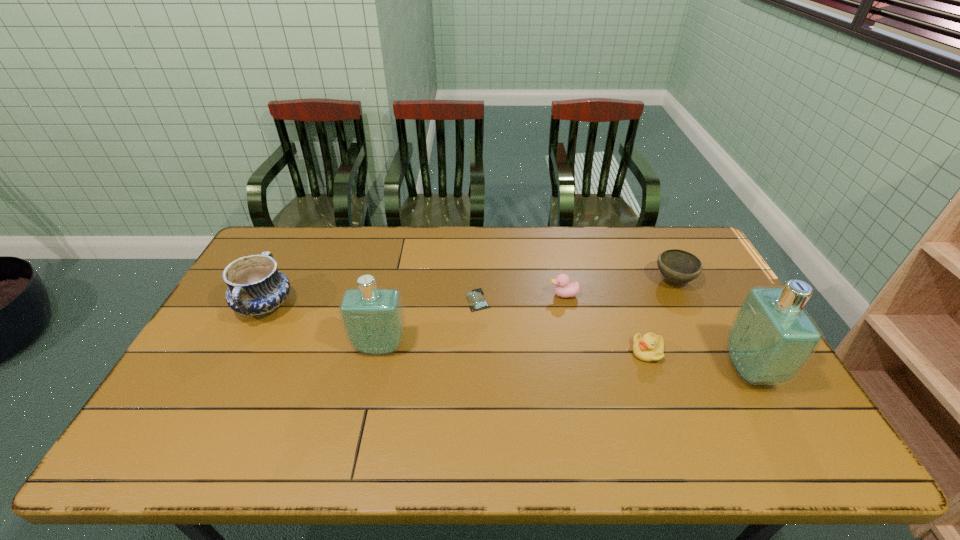
Where is `the sixth object from right to left`? Image resolution: width=960 pixels, height=540 pixels. the sixth object from right to left is located at coordinates (373, 319).

Locate an element on the screen. The width and height of the screenshot is (960, 540). the shorter perfume is located at coordinates (373, 319).

At what (x,y) coordinates should I click in order to perform the action: click on the right perfume. Please return your answer as a coordinate pair (x, y). Image resolution: width=960 pixels, height=540 pixels. Looking at the image, I should click on (771, 338).

Where is `the taller perfume`? the taller perfume is located at coordinates (771, 338).

Where is `pottery`? This screenshot has height=540, width=960. pottery is located at coordinates (256, 288).

Locate an element on the screen. the fifth shortest object is located at coordinates (256, 288).

The height and width of the screenshot is (540, 960). I want to click on the shortest object, so click(475, 298).

Image resolution: width=960 pixels, height=540 pixels. I want to click on identity card, so click(475, 298).

What are the coordinates of `bowl` in the screenshot? It's located at (677, 266).

At what (x,y) coordinates should I click in order to perform the action: click on the fourth object from right to left. Please return your answer as a coordinate pair (x, y). The width and height of the screenshot is (960, 540). Looking at the image, I should click on (564, 289).